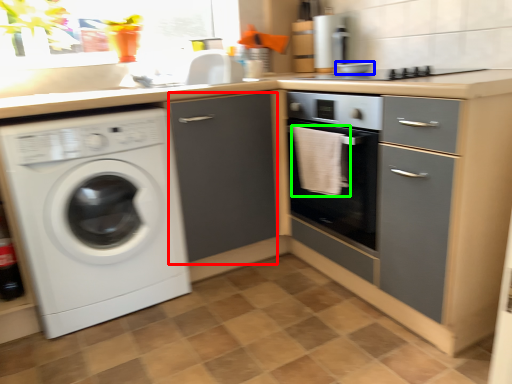
Question: Which object is the farthest from file cabinet (highlighted by a red box)? Choose among these: appliance (highlighted by a blue box) or material (highlighted by a green box).

Choices:
 (A) appliance
 (B) material

Answer: (A)